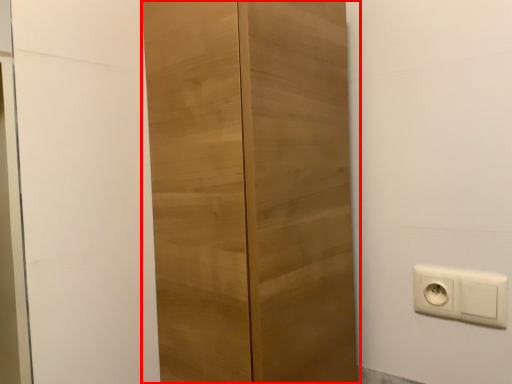
Question: From the image, what is the correct spatial relationship of cupboard (annotated by the red box) in relation to power plugs and sockets?

Choices:
 (A) right
 (B) left

Answer: (B)